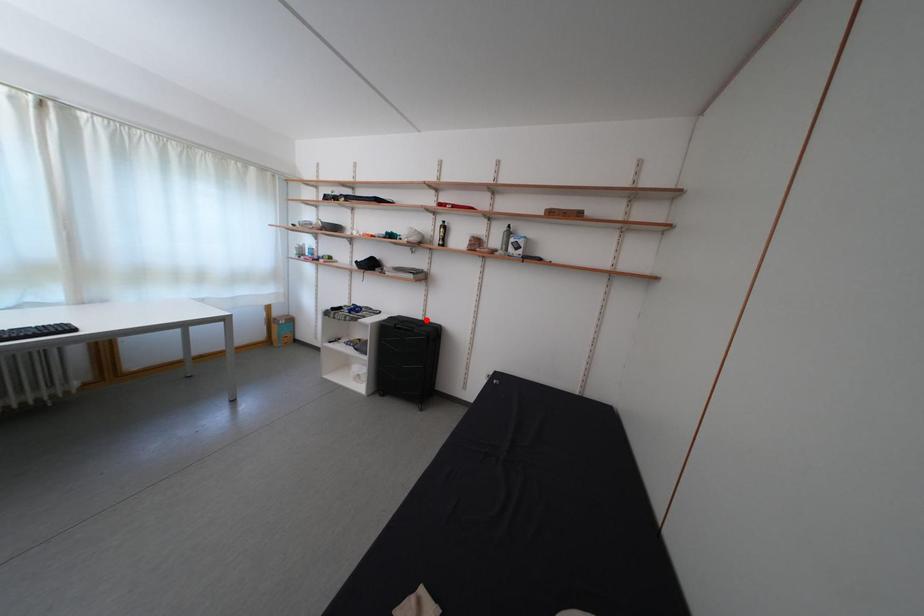
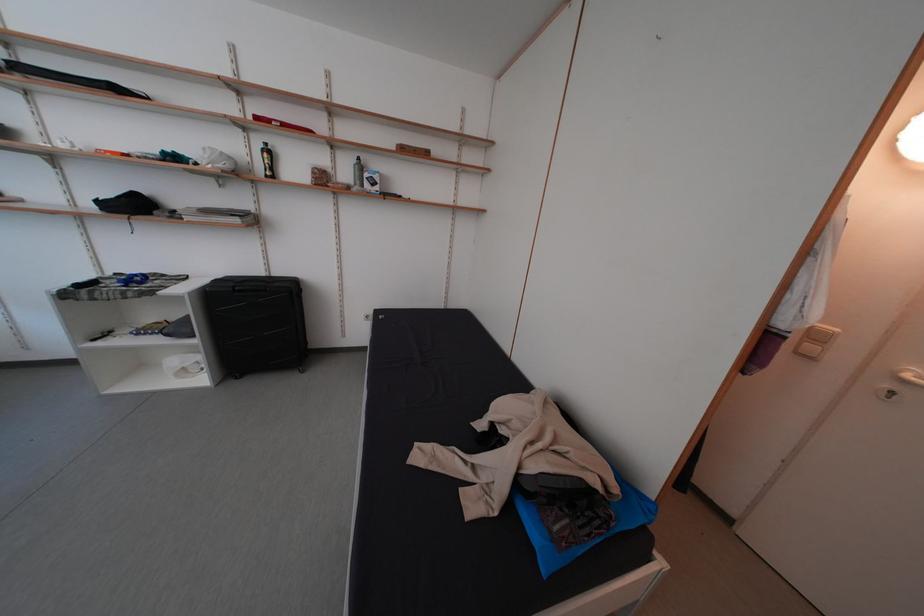
Where in the second image is the point corresponding to the highlighted location from the first image?

(265, 276)